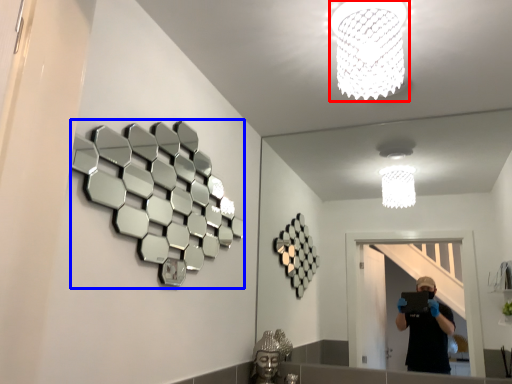
Question: Which object is further to the camera taking this photo, lamp (highlighted by a red box) or mirror (highlighted by a blue box)?

Choices:
 (A) lamp
 (B) mirror

Answer: (A)